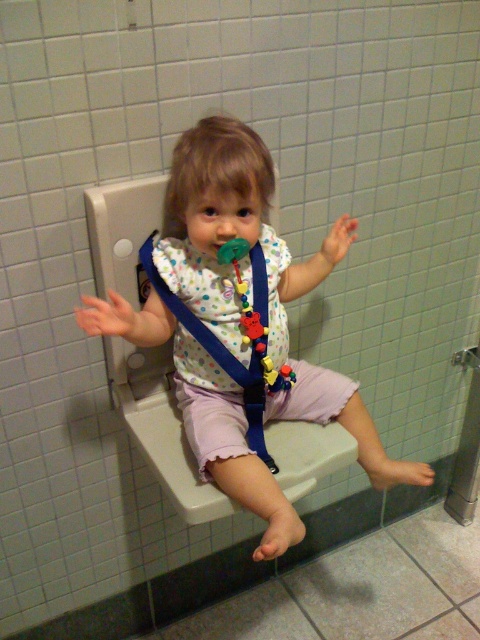
Who is more distant from viewer, [186,276] or [240,372]?

The point [240,372] is more distant.

Measure the distance from pastel polka dot shirt at center to white dotted fabric bib at center.

The distance of pastel polka dot shirt at center from white dotted fabric bib at center is 3.27 inches.

Describe the element at coordinates (251, 278) in the screenshot. This screenshot has width=480, height=640. I see `pastel polka dot shirt at center` at that location.

The height and width of the screenshot is (640, 480). Find the location of `pastel polka dot shirt at center`. pastel polka dot shirt at center is located at coordinates (251, 278).